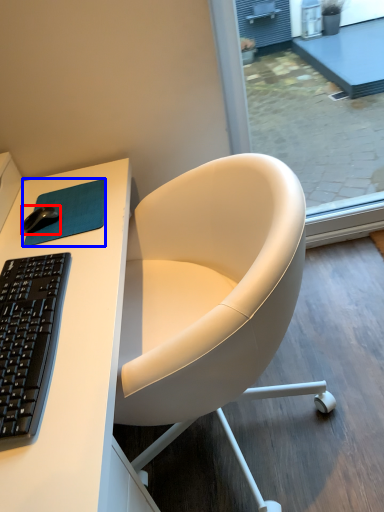
Question: Among these objects, which one is nearest to the camera, mouse (highlighted by a red box) or mousepad (highlighted by a blue box)?

Choices:
 (A) mouse
 (B) mousepad

Answer: (B)